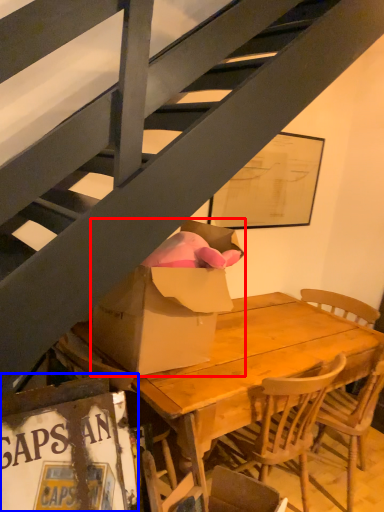
Question: Which object is closer to the camera taking this photo, box (highlighted by a red box) or picture frame (highlighted by a blue box)?

Choices:
 (A) box
 (B) picture frame

Answer: (B)